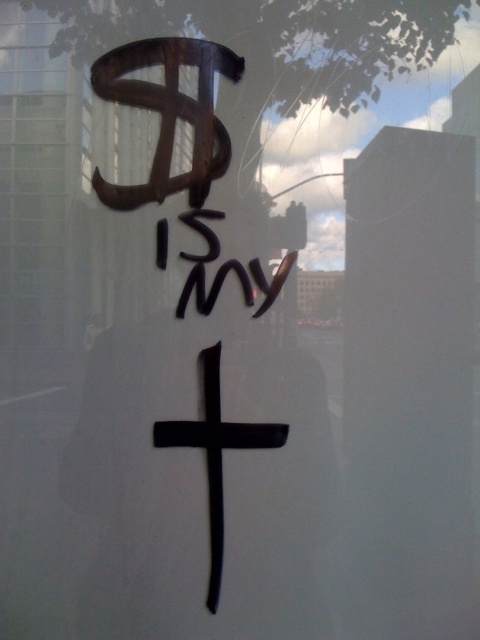
How distant is black matte cross at center from black ink writing at center?

They are 9.46 inches apart.

Which is above, black matte cross at center or black ink writing at center?

black ink writing at center is above.

This screenshot has height=640, width=480. What are the coordinates of `black matte cross at center` in the screenshot? It's located at (216, 452).